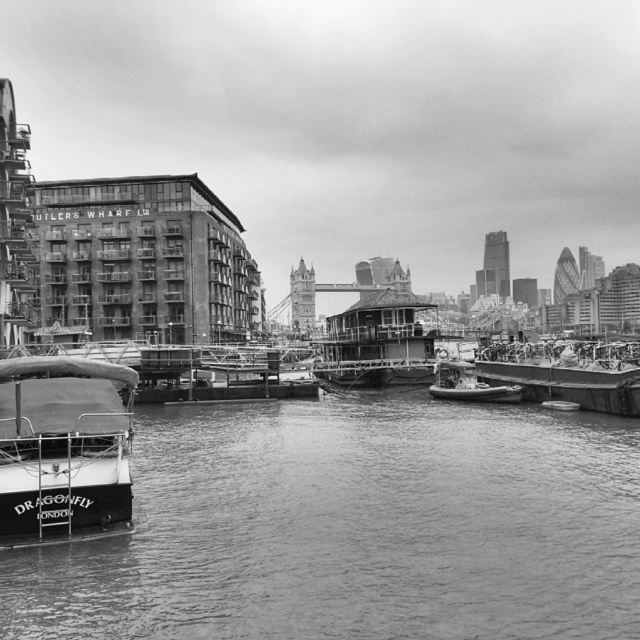
Question: Which point is closer to the camera?

Choices:
 (A) click(x=477, y=452)
 (B) click(x=115, y=406)

Answer: (B)

Question: Considering the relative positions of wooden deck houseboat at center and metallic gray boat at right in the image provided, where is wooden deck houseboat at center located with respect to metallic gray boat at right?

Choices:
 (A) left
 (B) right

Answer: (A)

Question: Is smooth water at lower left smaller than white matte boat at lower left?

Choices:
 (A) yes
 (B) no

Answer: (B)

Question: Is wooden deck houseboat at center in front of metallic gray boat at right?

Choices:
 (A) no
 (B) yes

Answer: (A)

Question: Based on their relative distances, which object is farther from the smooth water at lower left?

Choices:
 (A) metallic gray boat at right
 (B) wooden deck houseboat at center
 (C) white matte boat at lower left

Answer: (B)

Question: Which point is farther to the camera?

Choices:
 (A) metallic gray boat at right
 (B) smooth water at lower left

Answer: (A)